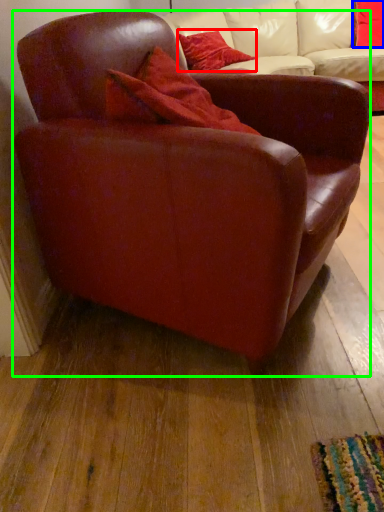
Question: Which object is the closest to the pillow (highlighted by a red box)? Choose among these: pillow (highlighted by a blue box) or chair (highlighted by a green box).

Choices:
 (A) pillow
 (B) chair

Answer: (A)